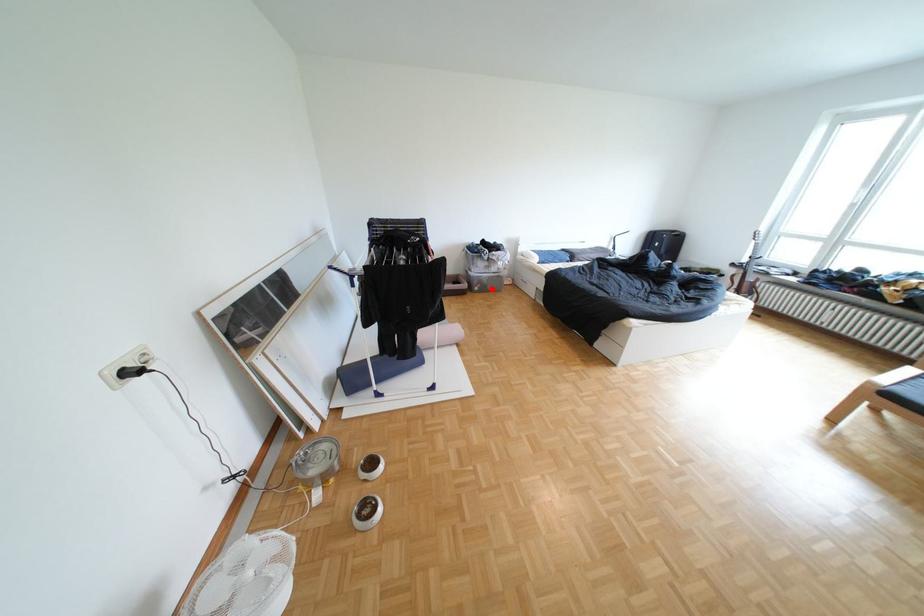
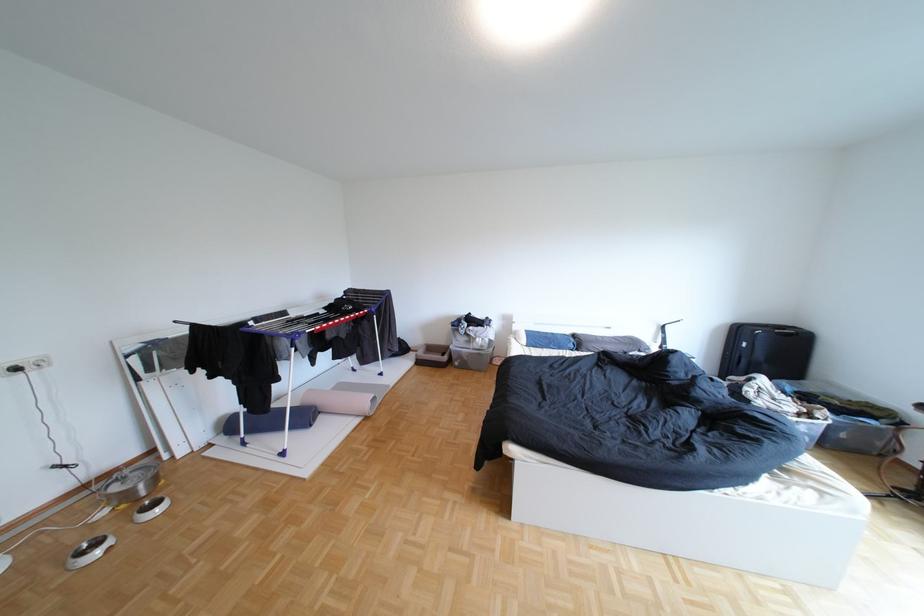
The point at the highlighted location is marked in the first image. Where is the corresponding point in the second image?

(472, 363)